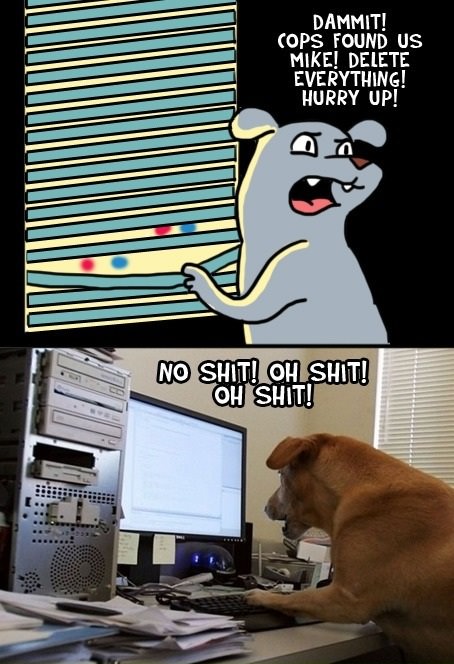
In order to click on window blinds in this screenshot , I will do `click(410, 422)`, `click(176, 118)`.